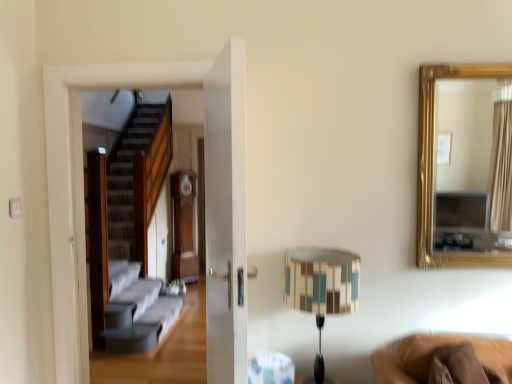
Question: Looking at their shapes, would you say gold-framed mirror at upper right is wider or thinner than multicolored fabric lampshade at center?

Choices:
 (A) thin
 (B) wide

Answer: (A)

Question: In terms of size, does gold-framed mirror at upper right appear bigger or smaller than multicolored fabric lampshade at center?

Choices:
 (A) big
 (B) small

Answer: (B)

Question: Visually, is gold-framed mirror at upper right positioned to the left or to the right of multicolored fabric lampshade at center?

Choices:
 (A) right
 (B) left

Answer: (A)

Question: Does point [301, 264] appear closer or farther from the camera than point [493, 244]?

Choices:
 (A) closer
 (B) farther

Answer: (A)

Question: Based on their positions, is multicolored fabric lampshade at center located to the left or right of gold-framed mirror at upper right?

Choices:
 (A) right
 (B) left

Answer: (B)

Question: Based on their sizes in the image, would you say multicolored fabric lampshade at center is bigger or smaller than gold-framed mirror at upper right?

Choices:
 (A) small
 (B) big

Answer: (B)

Question: From their relative heights in the image, would you say multicolored fabric lampshade at center is taller or shorter than gold-framed mirror at upper right?

Choices:
 (A) tall
 (B) short

Answer: (B)